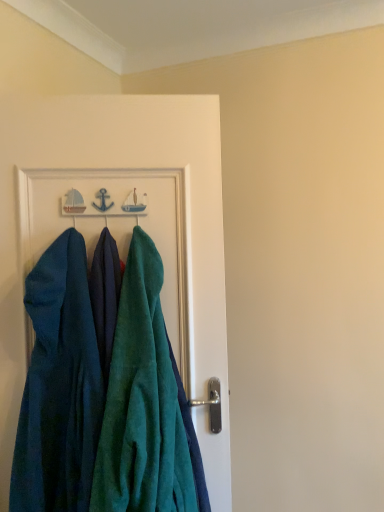
Question: Can you see teal towel at center touching teal velvety dress at left?

Choices:
 (A) yes
 (B) no

Answer: (B)

Question: Is teal velvety dress at left at the back of teal towel at center?

Choices:
 (A) yes
 (B) no

Answer: (A)

Question: Can you confirm if teal towel at center is bigger than teal velvety dress at left?

Choices:
 (A) no
 (B) yes

Answer: (B)

Question: From a real-world perspective, is teal towel at center on teal velvety dress at left?

Choices:
 (A) yes
 (B) no

Answer: (A)

Question: Is teal towel at center far away from teal velvety dress at left?

Choices:
 (A) yes
 (B) no

Answer: (B)

Question: Considering the relative sizes of teal towel at center and teal velvety dress at left in the image provided, is teal towel at center taller than teal velvety dress at left?

Choices:
 (A) no
 (B) yes

Answer: (B)

Question: Considering the relative positions of teal velvety towel at center and teal velvety dress at left in the image provided, is teal velvety towel at center in front of teal velvety dress at left?

Choices:
 (A) yes
 (B) no

Answer: (A)

Question: Considering the relative sizes of teal velvety towel at center and teal velvety dress at left in the image provided, is teal velvety towel at center taller than teal velvety dress at left?

Choices:
 (A) yes
 (B) no

Answer: (A)

Question: Is teal velvety towel at center smaller than teal velvety dress at left?

Choices:
 (A) yes
 (B) no

Answer: (B)

Question: Is teal velvety dress at left completely or partially inside teal velvety towel at center?

Choices:
 (A) yes
 (B) no

Answer: (B)

Question: Is teal velvety towel at center further to the viewer compared to teal velvety dress at left?

Choices:
 (A) yes
 (B) no

Answer: (B)

Question: From a real-world perspective, is teal velvety towel at center below teal velvety dress at left?

Choices:
 (A) no
 (B) yes

Answer: (B)

Question: Is teal velvety towel at center outside of teal towel at center?

Choices:
 (A) no
 (B) yes

Answer: (B)